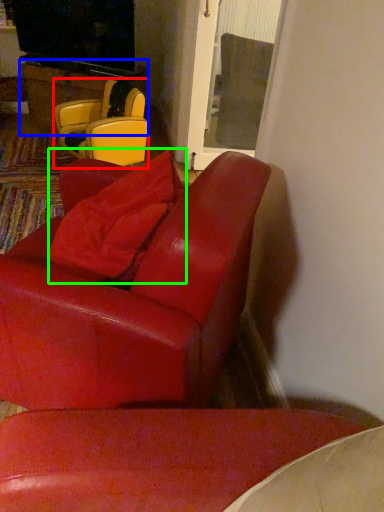
Question: Which is farther away from chair (highlighted by a red box)? table (highlighted by a blue box) or pillow (highlighted by a green box)?

Choices:
 (A) table
 (B) pillow

Answer: (B)